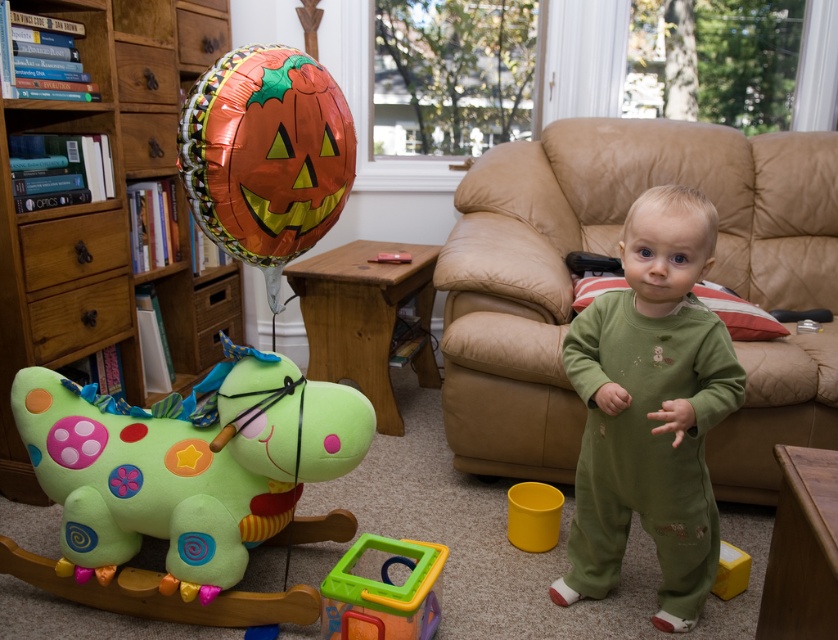
Image resolution: width=838 pixels, height=640 pixels. Identify the location of green plush rocking horse at lower left. tap(604, 253).

Is point (826, 252) less distant than point (688, 406)?

No, (826, 252) is further to viewer.

Identify the location of green plush rocking horse at lower left. (604, 253).

Can you confirm if green soft onesie at center is shorter than orange metallic balloon at upper left?

No.

Who is taller, green soft onesie at center or orange metallic balloon at upper left?

green soft onesie at center is taller.

Between point (694, 472) and point (328, 147), which one is positioned in front?

Point (328, 147)

I want to click on green soft onesie at center, so click(650, 410).

Does soft plush horse at left have a larger size compared to green soft onesie at center?

Incorrect, soft plush horse at left is not larger than green soft onesie at center.

Does soft plush horse at left have a greater width compared to green soft onesie at center?

Correct, the width of soft plush horse at left exceeds that of green soft onesie at center.

Where is `soft plush horse at left`? soft plush horse at left is located at coordinates (185, 465).